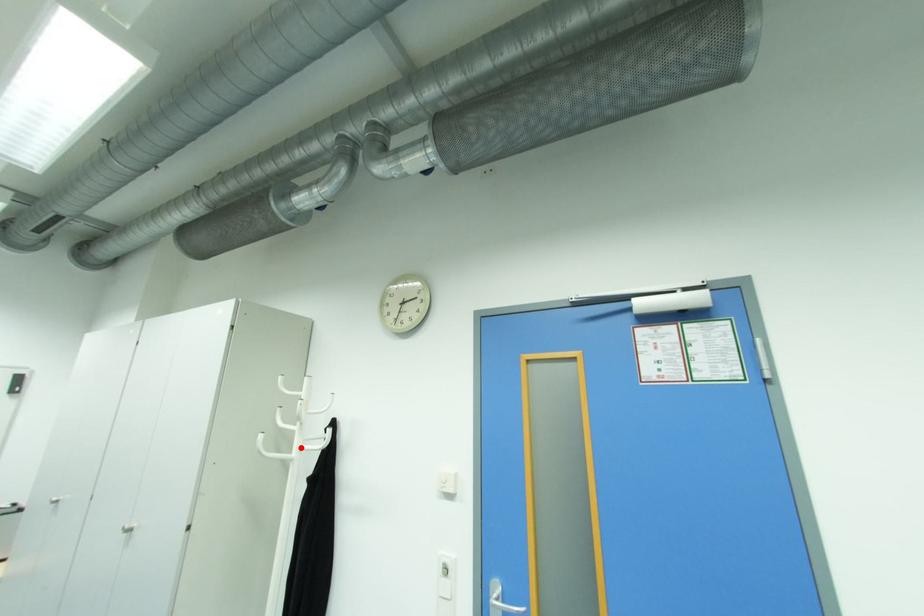
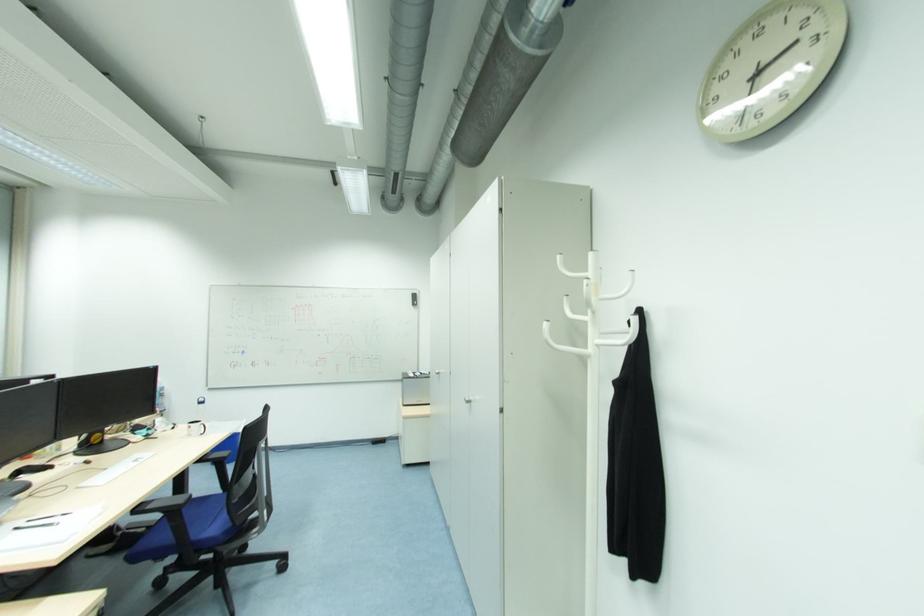
The point at the highlighted location is marked in the first image. Where is the corresponding point in the second image?

(596, 341)